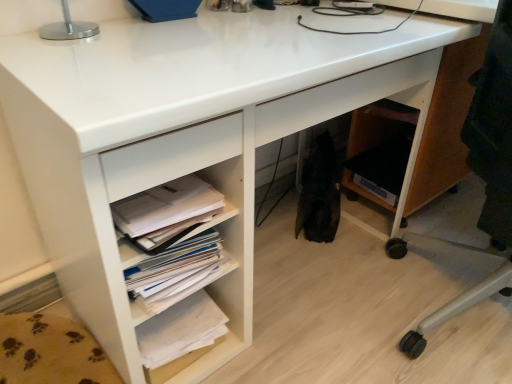
Question: Should I look upward or downward to see white paper stack at lower left, which appears as the second book when viewed from the top?

Choices:
 (A) up
 (B) down

Answer: (B)

Question: Can you confirm if silver metallic table lamp at upper left is taller than white paper at lower left?

Choices:
 (A) yes
 (B) no

Answer: (A)

Question: Is silver metallic table lamp at upper left outside of white paper at lower left?

Choices:
 (A) yes
 (B) no

Answer: (A)

Question: Can you confirm if silver metallic table lamp at upper left is thinner than white paper at lower left?

Choices:
 (A) yes
 (B) no

Answer: (A)

Question: From a real-world perspective, does silver metallic table lamp at upper left sit lower than white paper at lower left?

Choices:
 (A) yes
 (B) no

Answer: (B)

Question: Would you say silver metallic table lamp at upper left contains white paper at lower left?

Choices:
 (A) no
 (B) yes

Answer: (A)

Question: Does silver metallic table lamp at upper left have a smaller size compared to white paper at lower left?

Choices:
 (A) no
 (B) yes

Answer: (A)

Question: Is the position of silver metallic table lamp at upper left more distant than that of white paper stack at lower center, marked as the 1th book in a top-to-bottom arrangement?

Choices:
 (A) yes
 (B) no

Answer: (B)

Question: Is silver metallic table lamp at upper left wider than white paper stack at lower center, placed as the second book when sorted from bottom to top?

Choices:
 (A) no
 (B) yes

Answer: (A)

Question: Does silver metallic table lamp at upper left have a lesser height compared to white paper stack at lower center, marked as the 1th book in a top-to-bottom arrangement?

Choices:
 (A) yes
 (B) no

Answer: (B)

Question: Does silver metallic table lamp at upper left have a lesser width compared to white paper stack at lower center, placed as the second book when sorted from bottom to top?

Choices:
 (A) no
 (B) yes

Answer: (B)

Question: From the image's perspective, is silver metallic table lamp at upper left located above white paper stack at lower center, placed as the second book when sorted from bottom to top?

Choices:
 (A) yes
 (B) no

Answer: (A)

Question: From a real-world perspective, is silver metallic table lamp at upper left located beneath white paper stack at lower center, placed as the second book when sorted from bottom to top?

Choices:
 (A) yes
 (B) no

Answer: (B)

Question: Is white paper stack at lower center, marked as the 1th book in a top-to-bottom arrangement, thinner than white paper at lower left?

Choices:
 (A) yes
 (B) no

Answer: (A)